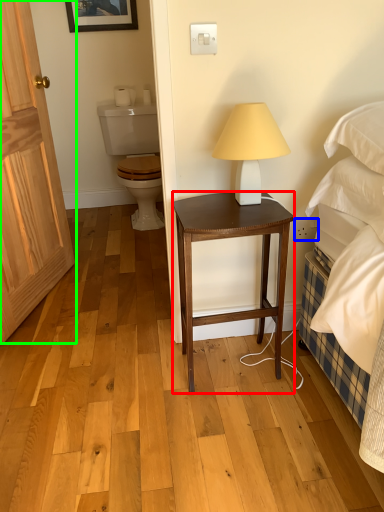
Question: Which object is positioned farthest from stool (highlighted by a red box)? Select from power outlet (highlighted by a blue box) and door (highlighted by a green box).

Choices:
 (A) power outlet
 (B) door

Answer: (B)